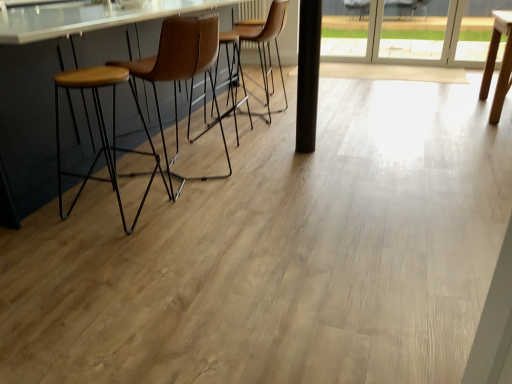
Question: Does brown leather stool at left, the second chair viewed from the back, touch matte wood counter at left?

Choices:
 (A) yes
 (B) no

Answer: (B)

Question: Does brown leather stool at left, the second chair viewed from the back, turn towards matte wood counter at left?

Choices:
 (A) no
 (B) yes

Answer: (B)

Question: From the image's perspective, is brown leather stool at left, the first chair when ordered from front to back, below matte wood counter at left?

Choices:
 (A) no
 (B) yes

Answer: (B)

Question: Is brown leather stool at left, the second chair viewed from the back, to the left of matte wood counter at left from the viewer's perspective?

Choices:
 (A) no
 (B) yes

Answer: (A)

Question: From a real-world perspective, does brown leather stool at left, the first chair when ordered from front to back, stand above matte wood counter at left?

Choices:
 (A) no
 (B) yes

Answer: (A)

Question: Can we say brown leather stool at left, the second chair viewed from the back, lies outside matte wood counter at left?

Choices:
 (A) yes
 (B) no

Answer: (A)

Question: From a real-world perspective, is transparent glass screen door at upper right on matte wood counter at left?

Choices:
 (A) yes
 (B) no

Answer: (B)

Question: Does transparent glass screen door at upper right have a greater height compared to matte wood counter at left?

Choices:
 (A) no
 (B) yes

Answer: (A)

Question: Is transparent glass screen door at upper right wider than matte wood counter at left?

Choices:
 (A) no
 (B) yes

Answer: (A)

Question: From the image's perspective, would you say transparent glass screen door at upper right is shown under matte wood counter at left?

Choices:
 (A) yes
 (B) no

Answer: (B)

Question: Is transparent glass screen door at upper right to the right of matte wood counter at left from the viewer's perspective?

Choices:
 (A) yes
 (B) no

Answer: (A)

Question: Is transparent glass screen door at upper right at the left side of matte wood counter at left?

Choices:
 (A) yes
 (B) no

Answer: (B)

Question: Does brown leather chair at center, the 1th chair from the back, have a lesser height compared to wooden seat stool at left?

Choices:
 (A) no
 (B) yes

Answer: (A)